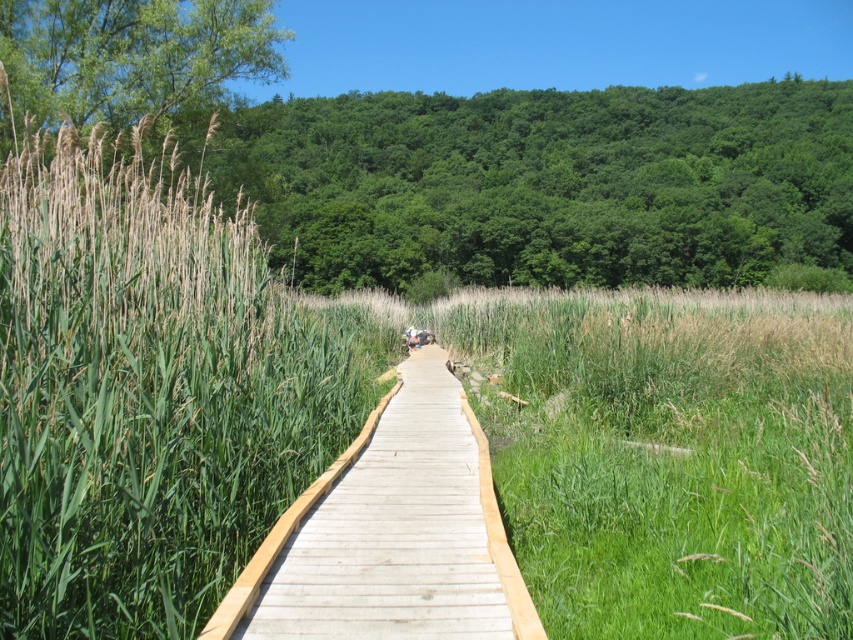
Between point (752, 416) and point (409, 580), which one is positioned in front?

Point (409, 580)

Is green grass at center positioned in front of wooden boardwalk at center?

That is True.

Does point (585, 588) come in front of point (408, 390)?

Yes, it is.

Locate an element on the screen. Image resolution: width=853 pixels, height=640 pixels. green grass at center is located at coordinates (663, 451).